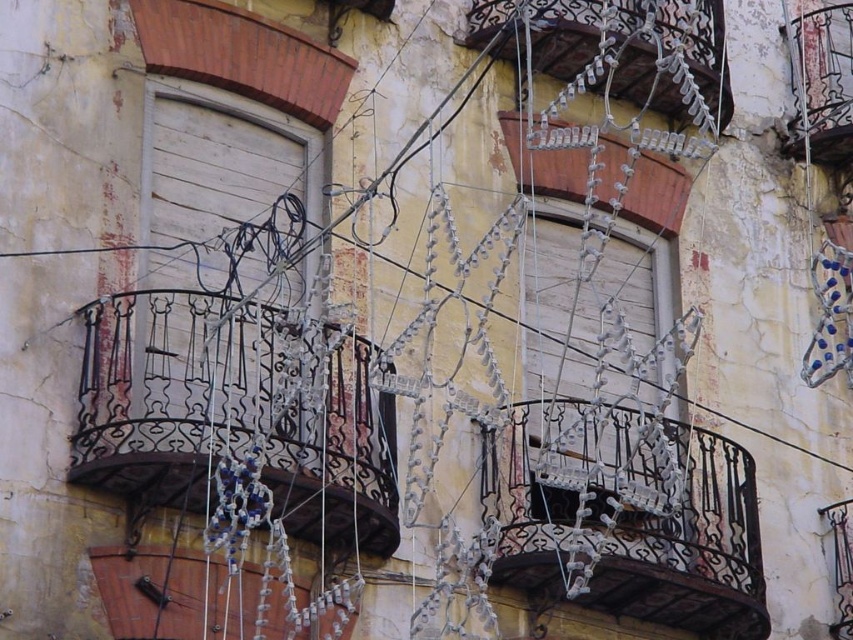
You are standing in front of the building and notice the white metallic balcony at upper center and the metallic wire balcony at lower left. Which balcony is positioned to the right side of the other?

The white metallic balcony at upper center is positioned to the right of the metallic wire balcony at lower left.

You are standing in front of the building and notice two balconies. The black wrought iron balcony at left and the white metallic balcony at upper center. Which balcony is positioned to the left of the other?

The black wrought iron balcony at left is positioned to the left of the white metallic balcony at upper center.

You are standing in front of the building facade and want to touch both points mentioned. Which point should you reach for first, the point at coordinates (618,596) or the point at (229,611)?

You should reach for the point at coordinates (618,596) first because it is closer to you than the point at (229,611), which is further away.